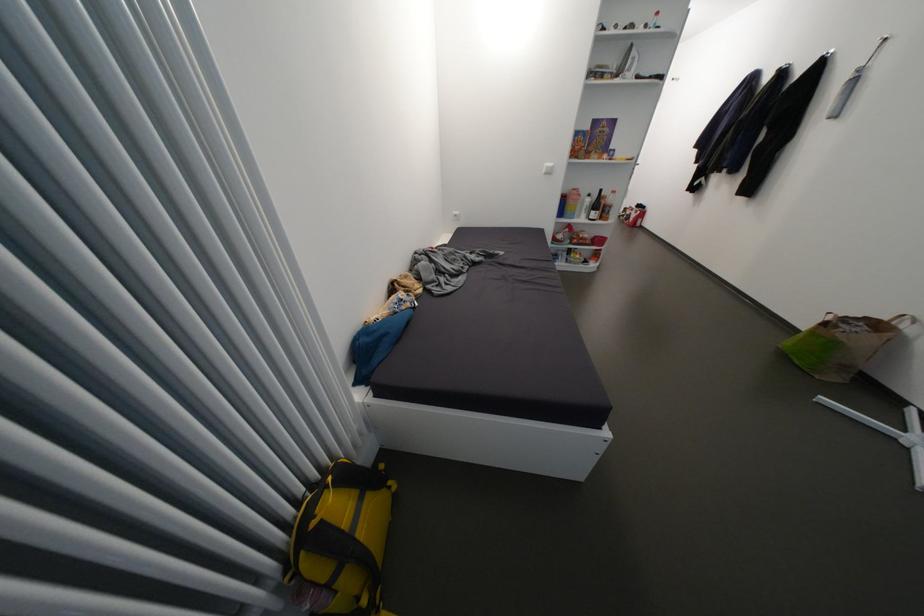
Locate an element on the screen. This screenshot has width=924, height=616. fire extinguisher handle is located at coordinates (633, 215).